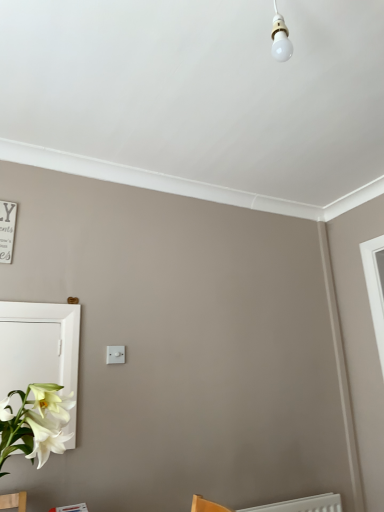
Question: Would you consider white glossy medicine cabinet at lower left to be distant from white plastic light switch at center?

Choices:
 (A) yes
 (B) no

Answer: (B)

Question: Is white glossy medicine cabinet at lower left looking in the opposite direction of white plastic light switch at center?

Choices:
 (A) yes
 (B) no

Answer: (B)

Question: From a real-world perspective, is white glossy medicine cabinet at lower left below white plastic light switch at center?

Choices:
 (A) yes
 (B) no

Answer: (A)

Question: From a real-world perspective, is white glossy medicine cabinet at lower left on white plastic light switch at center?

Choices:
 (A) yes
 (B) no

Answer: (B)

Question: Is white glossy medicine cabinet at lower left smaller than white plastic light switch at center?

Choices:
 (A) yes
 (B) no

Answer: (B)

Question: Is white glossy medicine cabinet at lower left outside of white plastic light switch at center?

Choices:
 (A) no
 (B) yes

Answer: (B)

Question: Is white plastic light switch at center to the left of white glossy medicine cabinet at lower left from the viewer's perspective?

Choices:
 (A) no
 (B) yes

Answer: (A)

Question: Could you tell me if white plastic light switch at center is turned towards white glossy medicine cabinet at lower left?

Choices:
 (A) yes
 (B) no

Answer: (B)

Question: Can you confirm if white plastic light switch at center is taller than white glossy medicine cabinet at lower left?

Choices:
 (A) no
 (B) yes

Answer: (A)

Question: Considering the relative sizes of white plastic light switch at center and white glossy medicine cabinet at lower left in the image provided, is white plastic light switch at center thinner than white glossy medicine cabinet at lower left?

Choices:
 (A) yes
 (B) no

Answer: (A)

Question: From the image's perspective, does white plastic light switch at center appear lower than white glossy medicine cabinet at lower left?

Choices:
 (A) yes
 (B) no

Answer: (B)

Question: Is the position of white plastic light switch at center more distant than that of white glossy medicine cabinet at lower left?

Choices:
 (A) yes
 (B) no

Answer: (A)

Question: Is white plastic light switch at center spatially inside white glossy medicine cabinet at lower left, or outside of it?

Choices:
 (A) outside
 (B) inside

Answer: (A)